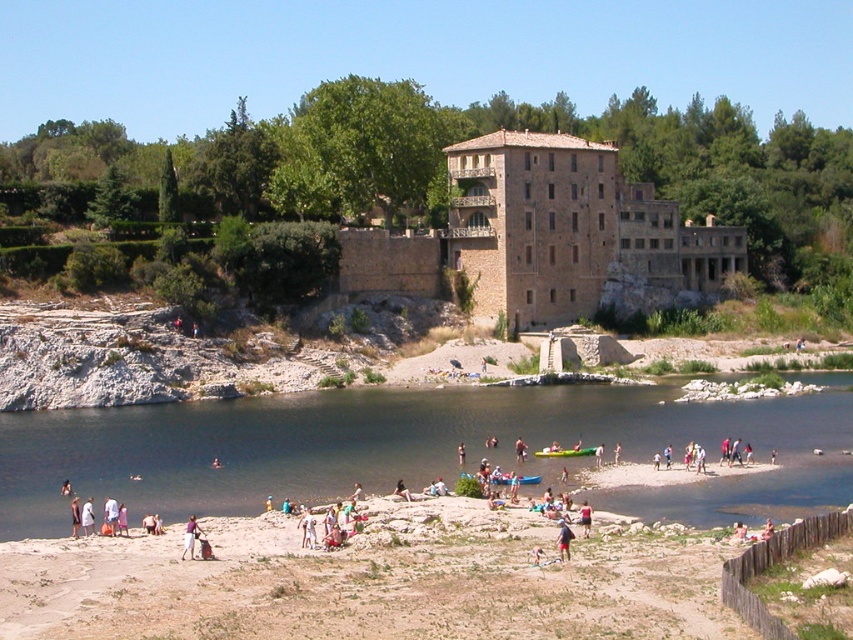
Question: Which object is positioned farthest from the light brown fabric pants at lower center?

Choices:
 (A) dark blue fabric shorts at lower center
 (B) light pink fabric at lower left
 (C) red fabric bag at center

Answer: (C)

Question: Can you confirm if white cotton dress at lower center is bigger than red fabric bag at center?

Choices:
 (A) yes
 (B) no

Answer: (A)

Question: Which object is the closest to the light brown fabric pants at lower center?

Choices:
 (A) dark blue fabric shorts at lower center
 (B) light pink fabric at lower left
 (C) dark blue fabric dress at lower left
 (D) red fabric bag at center

Answer: (B)

Question: Is dark blue water at lower center positioned behind dark blue fabric dress at lower left?

Choices:
 (A) yes
 (B) no

Answer: (B)

Question: Is light pink fabric at lower center positioned behind dark blue fabric dress at lower left?

Choices:
 (A) yes
 (B) no

Answer: (B)

Question: Which object is the farthest from the white cotton dress at lower center?

Choices:
 (A) light pink fabric at lower left
 (B) dark blue fabric dress at lower left
 (C) dark blue fabric shorts at lower center
 (D) light brown fabric pants at lower center

Answer: (C)